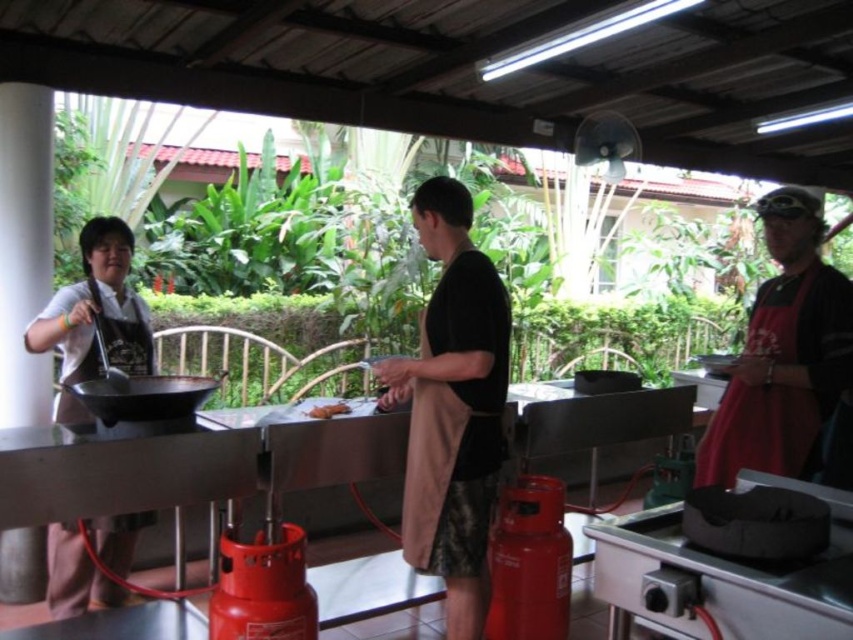
Which of these two, red fabric shirt at right or black matte wok at left, stands taller?

red fabric shirt at right

You are a GUI agent. You are given a task and a screenshot of the screen. Output one action in this format:
    pyautogui.click(x=<x>, y=<y>)
    Task: Click on the red fabric shirt at right
    
    Given the screenshot: What is the action you would take?
    pyautogui.click(x=782, y=353)

Measure the distance between point (483, 410) and camera.

Point (483, 410) is 7.28 feet away from camera.

Which is below, black matte apron at center or red matte gas canister at lower center?

Positioned lower is red matte gas canister at lower center.

Who is more forward, (434, 468) or (489, 550)?

Point (434, 468) is in front.

What are the coordinates of `black matte apron at center` in the screenshot? It's located at (453, 406).

Identify the location of black matte wok at left. [138, 396].

Measure the distance between black matte wok at left and camera.

2.13 meters

The width and height of the screenshot is (853, 640). I want to click on black matte wok at left, so click(x=138, y=396).